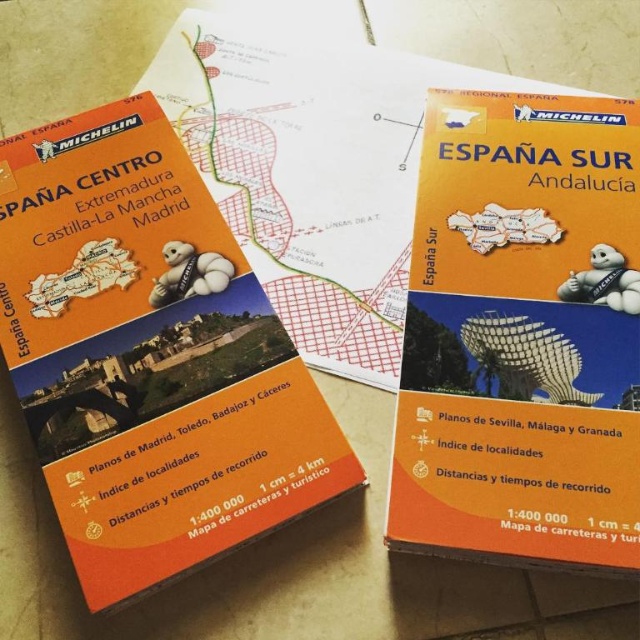
Question: Which object is the farthest from the metallic bird at center?

Choices:
 (A) orange matte map at upper right
 (B) white plush toy at center
 (C) white rubber michelin man at center

Answer: (B)

Question: Which object is positioned farthest from the white rubber michelin man at center?

Choices:
 (A) white plush toy at center
 (B) orange matte map at upper right

Answer: (A)

Question: Which of the following is the closest to the observer?

Choices:
 (A) (624, 125)
 (B) (212, 394)
 (C) (195, 284)

Answer: (B)

Question: Considering the relative positions of orange matte map at upper left and orange matte map at upper right in the image provided, where is orange matte map at upper left located with respect to orange matte map at upper right?

Choices:
 (A) right
 (B) left

Answer: (B)

Question: Is the position of white rubber michelin man at center less distant than that of white plush toy at center?

Choices:
 (A) yes
 (B) no

Answer: (A)

Question: Does white rubber michelin man at center appear over white plush toy at center?

Choices:
 (A) no
 (B) yes

Answer: (A)